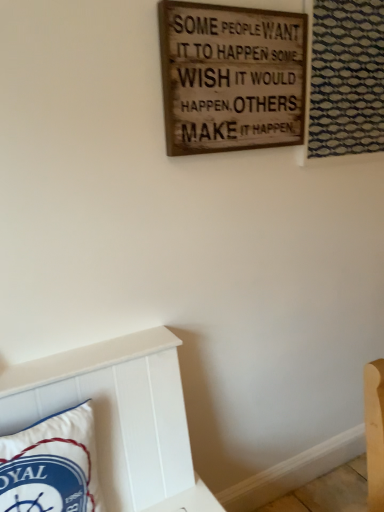
Question: Is point (34, 490) closer or farther from the camera than point (370, 29)?

Choices:
 (A) closer
 (B) farther

Answer: (A)

Question: From a real-world perspective, is white fabric pillow at lower left above or below blue textured fabric at upper right?

Choices:
 (A) below
 (B) above

Answer: (A)

Question: Estimate the real-world distances between objects in this image. Which object is closer to the white fabric pillow at lower left?

Choices:
 (A) blue textured fabric at upper right
 (B) wooden signboard at upper center

Answer: (B)

Question: Estimate the real-world distances between objects in this image. Which object is closer to the wooden signboard at upper center?

Choices:
 (A) white fabric pillow at lower left
 (B) blue textured fabric at upper right

Answer: (B)